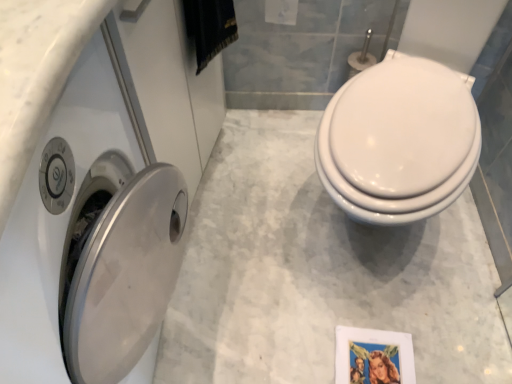
The height and width of the screenshot is (384, 512). Find the location of `white glossy toilet at right`. white glossy toilet at right is located at coordinates (398, 141).

Describe the element at coordinates (281, 11) in the screenshot. I see `white glossy toilet paper at upper center` at that location.

Identify the location of white glossy toilet paper at upper center. (281, 11).

Where is `metallic silver picture frame at lower right`? metallic silver picture frame at lower right is located at coordinates (373, 356).

What is the approximate width of metallic silver picture frame at lower right?

11.73 inches.

Describe the element at coordinates (89, 241) in the screenshot. I see `satin silver washer at left` at that location.

The image size is (512, 384). Find the location of `white glossy toilet at right`. white glossy toilet at right is located at coordinates (398, 141).

From the image's perspective, between metallic silver picture frame at lower right and white glossy toilet paper at upper center, which one is located above?

white glossy toilet paper at upper center appears higher in the image.

Which of these two, metallic silver picture frame at lower right or white glossy toilet paper at upper center, is wider?

metallic silver picture frame at lower right is wider.

Is metallic silver picture frame at lower right facing away from white glossy toilet paper at upper center?

No, metallic silver picture frame at lower right is not facing away from white glossy toilet paper at upper center.

Is white glossy toilet paper at upper center positioned with its back to metallic silver picture frame at lower right?

No, white glossy toilet paper at upper center is not facing away from metallic silver picture frame at lower right.

From a real-world perspective, which object stands above the other?

white glossy toilet paper at upper center.

From the picture: Are white glossy toilet paper at upper center and metallic silver picture frame at lower right making contact?

No, white glossy toilet paper at upper center is not in contact with metallic silver picture frame at lower right.

What's the angular difference between white glossy toilet paper at upper center and metallic silver picture frame at lower right's facing directions?

white glossy toilet paper at upper center and metallic silver picture frame at lower right are facing 4.43 degrees away from each other.

Is there a large distance between satin silver washer at left and white glossy toilet at right?

No, satin silver washer at left is not far away from white glossy toilet at right.

Based on their sizes in the image, would you say satin silver washer at left is bigger or smaller than white glossy toilet at right?

satin silver washer at left is bigger than white glossy toilet at right.

From the image's perspective, which one is positioned lower, satin silver washer at left or white glossy toilet at right?

satin silver washer at left, from the image's perspective.

Can you confirm if white glossy toilet at right is wider than satin silver washer at left?

Yes, white glossy toilet at right is wider than satin silver washer at left.

Is white glossy toilet at right in front of satin silver washer at left?

No, white glossy toilet at right is further to the viewer.

From the image's perspective, is white glossy toilet at right on top of satin silver washer at left?

Correct, white glossy toilet at right appears higher than satin silver washer at left in the image.

From a real-world perspective, which object stands above the other?

From a 3D spatial view, white glossy toilet at right is above.

Considering the sizes of objects white glossy toilet paper at upper center and satin silver washer at left in the image provided, who is smaller, white glossy toilet paper at upper center or satin silver washer at left?

Smaller between the two is white glossy toilet paper at upper center.

Does white glossy toilet paper at upper center appear on the left side of satin silver washer at left?

No, white glossy toilet paper at upper center is not to the left of satin silver washer at left.

From the image's perspective, is white glossy toilet paper at upper center above satin silver washer at left?

Yes.

Is white glossy toilet paper at upper center facing towards satin silver washer at left?

No, white glossy toilet paper at upper center is not turned towards satin silver washer at left.

What's the angular difference between metallic silver picture frame at lower right and satin silver washer at left's facing directions?

93.1 degrees separate the facing orientations of metallic silver picture frame at lower right and satin silver washer at left.

Is satin silver washer at left located within metallic silver picture frame at lower right?

Actually, satin silver washer at left is outside metallic silver picture frame at lower right.

In terms of width, does metallic silver picture frame at lower right look wider or thinner when compared to satin silver washer at left?

Considering their sizes, metallic silver picture frame at lower right looks slimmer than satin silver washer at left.

In the image, there is a metallic silver picture frame at lower right. Where is `washer above it (from the image's perspective)`? The image size is (512, 384). washer above it (from the image's perspective) is located at coordinates (89, 241).

How far apart are satin silver washer at left and white glossy toilet paper at upper center?

satin silver washer at left is 37.78 inches away from white glossy toilet paper at upper center.

Between satin silver washer at left and white glossy toilet paper at upper center, which one appears on the left side from the viewer's perspective?

satin silver washer at left.

Looking at their sizes, would you say satin silver washer at left is wider or thinner than white glossy toilet paper at upper center?

Considering their sizes, satin silver washer at left looks broader than white glossy toilet paper at upper center.

The height and width of the screenshot is (384, 512). I want to click on toilet paper above the satin silver washer at left (from the image's perspective), so click(x=281, y=11).

Locate an element on the screen. The height and width of the screenshot is (384, 512). picture frame behind the white glossy toilet paper at upper center is located at coordinates (373, 356).

Identify the location of toilet paper located on the left of metallic silver picture frame at lower right. The width and height of the screenshot is (512, 384). (281, 11).

From the image, which object appears to be farther from white glossy toilet at right, white glossy toilet paper at upper center or metallic silver picture frame at lower right?

Among the two, white glossy toilet paper at upper center is located further to white glossy toilet at right.

Looking at the image, which one is located further to white glossy toilet at right, satin silver washer at left or white glossy toilet paper at upper center?

The object further to white glossy toilet at right is white glossy toilet paper at upper center.

When comparing their distances from white glossy toilet paper at upper center, does white glossy toilet at right or satin silver washer at left seem further?

satin silver washer at left.

Based on their spatial positions, is white glossy toilet paper at upper center or white glossy toilet at right further from satin silver washer at left?

white glossy toilet paper at upper center.

Looking at the image, which one is located further to white glossy toilet paper at upper center, satin silver washer at left or white glossy toilet at right?

satin silver washer at left lies further to white glossy toilet paper at upper center than the other object.

When comparing their distances from metallic silver picture frame at lower right, does white glossy toilet at right or satin silver washer at left seem further?

The object further to metallic silver picture frame at lower right is satin silver washer at left.

In the scene shown: Based on their spatial positions, is metallic silver picture frame at lower right or white glossy toilet paper at upper center closer to white glossy toilet at right?

The object closer to white glossy toilet at right is metallic silver picture frame at lower right.

Estimate the real-world distances between objects in this image. Which object is further from white glossy toilet at right, white glossy toilet paper at upper center or satin silver washer at left?

Based on the image, white glossy toilet paper at upper center appears to be further to white glossy toilet at right.

This screenshot has height=384, width=512. I want to click on washer between white glossy toilet paper at upper center and metallic silver picture frame at lower right in the up-down direction, so click(x=89, y=241).

The image size is (512, 384). Identify the location of toilet between white glossy toilet paper at upper center and metallic silver picture frame at lower right vertically. (398, 141).

Where is `picture frame situated between satin silver washer at left and white glossy toilet at right from left to right`? The image size is (512, 384). picture frame situated between satin silver washer at left and white glossy toilet at right from left to right is located at coordinates (373, 356).

Find the location of a particular element. This screenshot has height=384, width=512. toilet paper situated between satin silver washer at left and white glossy toilet at right from left to right is located at coordinates (281, 11).